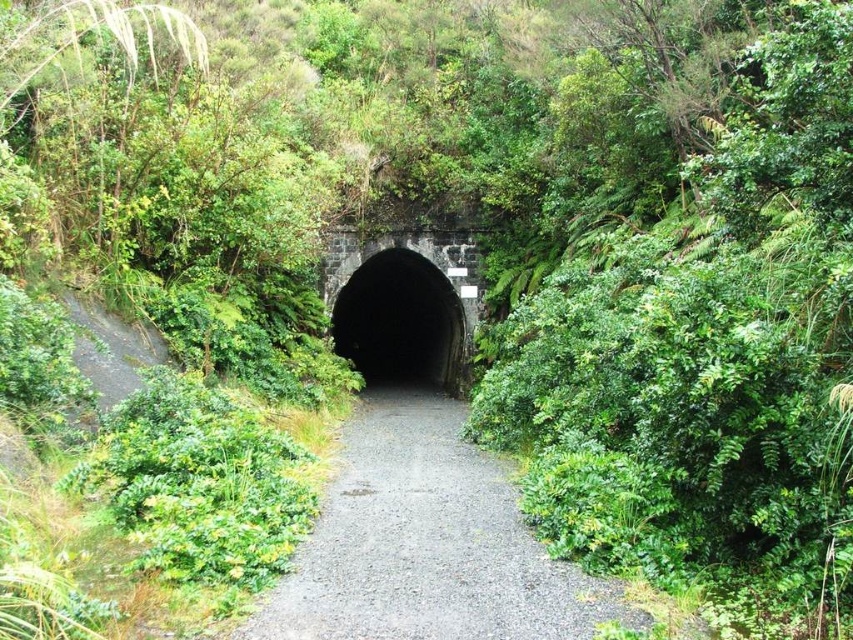
Question: Considering the relative positions of gray gravel path at center and black stone tunnel at center in the image provided, where is gray gravel path at center located with respect to black stone tunnel at center?

Choices:
 (A) right
 (B) left

Answer: (A)

Question: Is gray gravel path at center wider than black stone tunnel at center?

Choices:
 (A) yes
 (B) no

Answer: (B)

Question: From the image, what is the correct spatial relationship of gray gravel path at center in relation to black stone tunnel at center?

Choices:
 (A) left
 (B) right

Answer: (B)

Question: Which of the following is the closest to the observer?

Choices:
 (A) black stone tunnel at center
 (B) gray gravel path at center

Answer: (B)